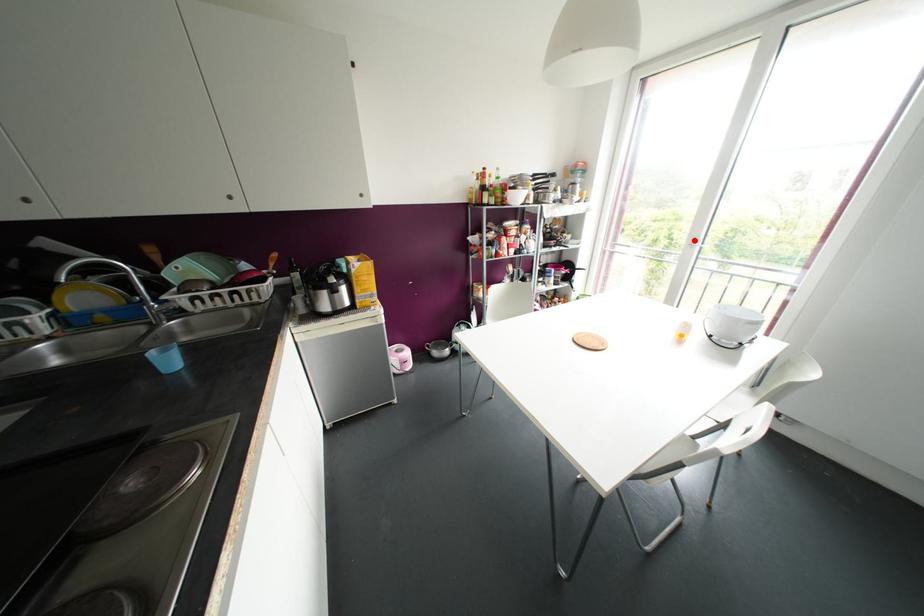
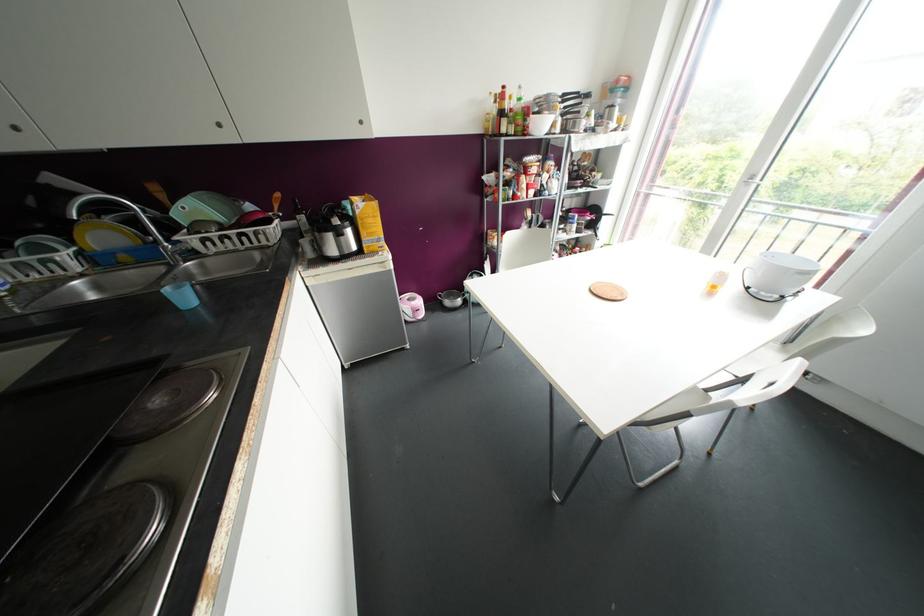
The point at the highlighted location is marked in the first image. Where is the corresponding point in the second image?

(752, 177)